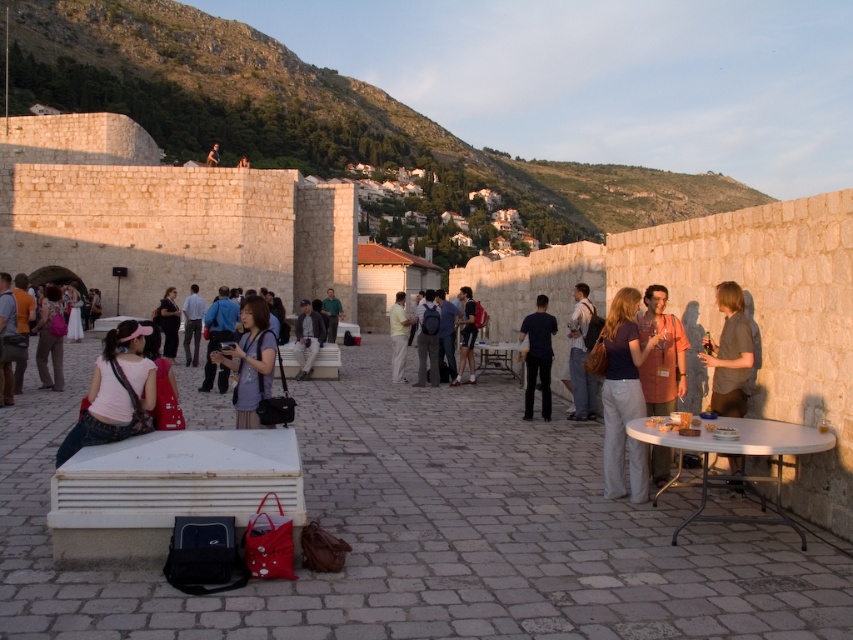
You are a photographer positioned at the edge of the courtyard, aiming to capture a photo that includes both the matte pink shirt at center and the dark blue backpack at center. Based on their positions, which object will appear closer to the camera in the final photo?

The matte pink shirt at center appears closer to the camera in the photo because it is positioned in front of the dark blue backpack at center.

From the picture: You are standing at the point marked as point [660,355] in the image. What is the color of the fabric you are standing on?

The point [660,355] is on orange fabric shirt at center, so the fabric is orange.